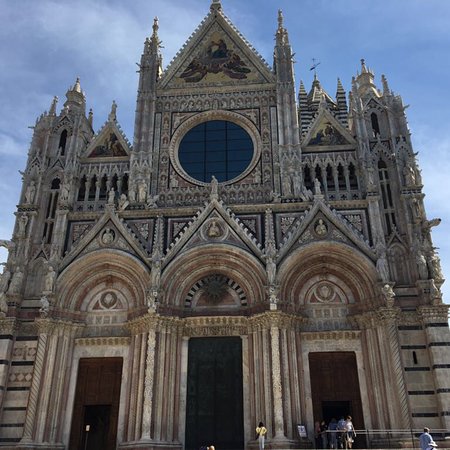
I want to click on wall, so click(x=424, y=379).